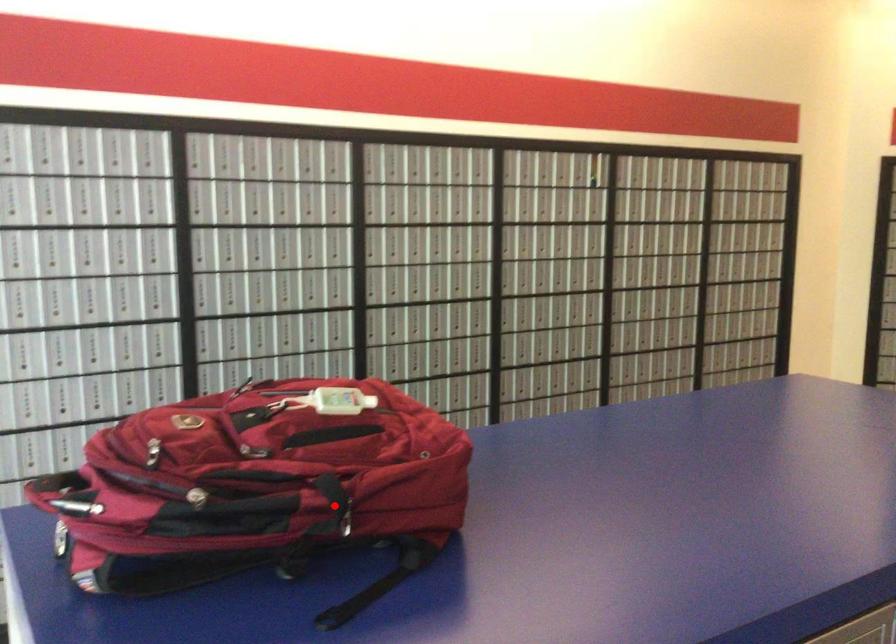
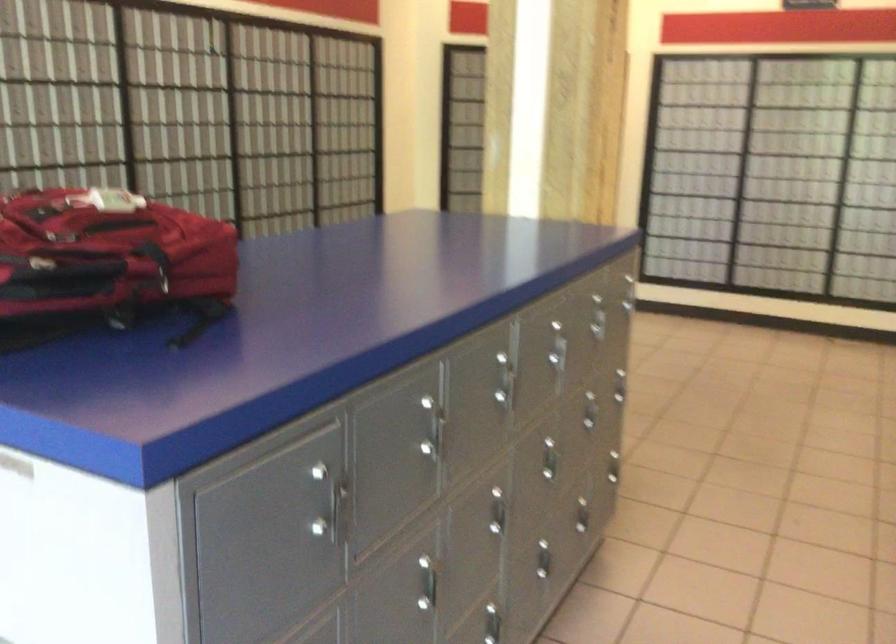
Question: I am providing you with two images of the same scene from different viewpoints. A red point is shown in image1. For the corresponding object point in image2, is it positioned nearer or farther from the camera?

Choices:
 (A) Nearer
 (B) Farther

Answer: (B)